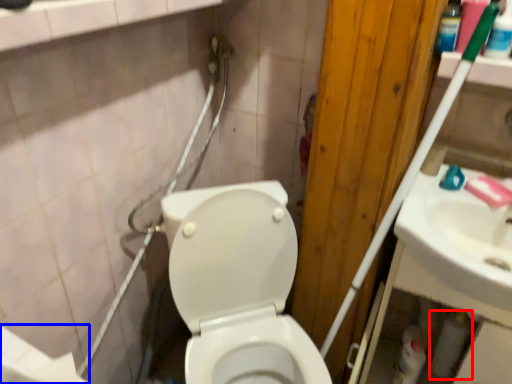
Question: Which of the following is the farthest to the observer, toilet paper (highlighted by a red box) or toilet paper (highlighted by a blue box)?

Choices:
 (A) toilet paper
 (B) toilet paper

Answer: (A)